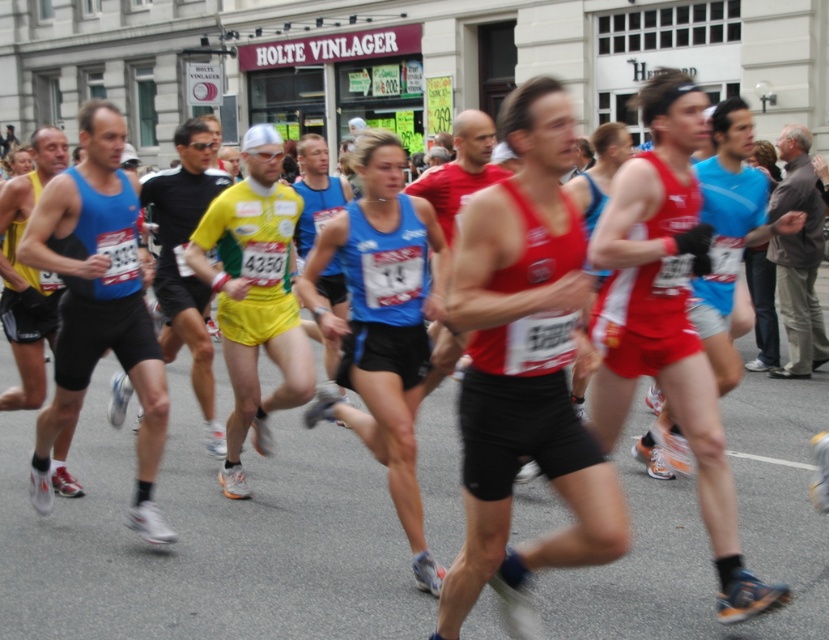
Question: Is yellow fabric shorts at left above brown textured shirt at right?

Choices:
 (A) yes
 (B) no

Answer: (B)

Question: Which object is the farthest from the blue fabric tank top at center?

Choices:
 (A) red matte shorts at center
 (B) matte blue tank top at left

Answer: (A)

Question: Does blue fabric tank top at center have a greater width compared to red matte shorts at center?

Choices:
 (A) no
 (B) yes

Answer: (A)

Question: Which point appears farthest from the camera in this image?

Choices:
 (A) (505, 442)
 (B) (62, 496)
 (C) (217, 436)
 (D) (108, 320)

Answer: (C)

Question: Does matte blue tank top at left appear on the right side of yellow fabric shorts at center?

Choices:
 (A) yes
 (B) no

Answer: (B)

Question: Which of the following is the closest to the observer?

Choices:
 (A) blue fabric tank top at center
 (B) yellow fabric shorts at left

Answer: (A)